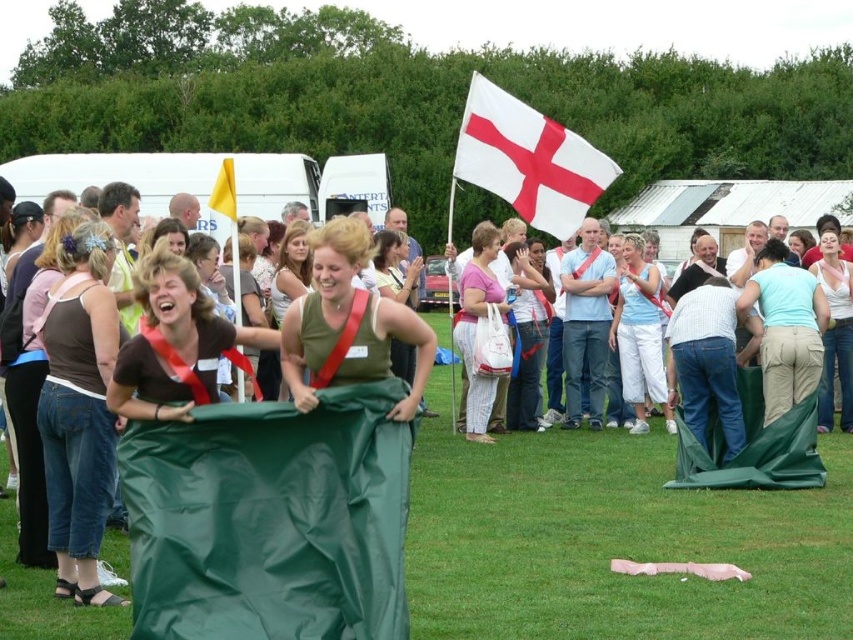
In the scene shown: Is matte pink shirt at center closer to the viewer compared to white matte tank top at center?

No, it is not.

Which of these two, matte pink shirt at center or white matte tank top at center, stands taller?

Standing taller between the two is matte pink shirt at center.

Is point (468, 282) closer to viewer compared to point (827, 342)?

Yes, it is.

Identify the location of matte pink shirt at center. This screenshot has width=853, height=640. (476, 326).

Is point (154, 252) closer to camera compared to point (846, 308)?

Yes, point (154, 252) is closer to viewer.

Identify the location of brown fabric bag at center. This screenshot has height=640, width=853. (173, 342).

Image resolution: width=853 pixels, height=640 pixels. In order to click on brown fabric bag at center in this screenshot , I will do `click(173, 342)`.

Who is positioned more to the right, white cotton tank top at center or matte pink shirt at center?

Positioned to the right is white cotton tank top at center.

Based on the photo, is white cotton tank top at center closer to camera compared to matte pink shirt at center?

That is False.

What do you see at coordinates (639, 333) in the screenshot? I see `white cotton tank top at center` at bounding box center [639, 333].

Locate an element on the screen. This screenshot has width=853, height=640. white cotton tank top at center is located at coordinates tap(639, 333).